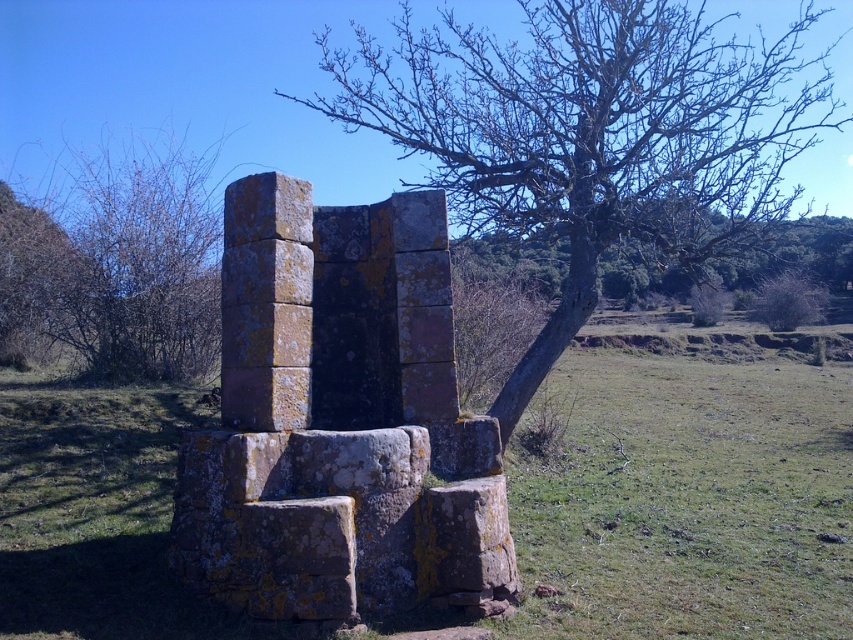
Can you confirm if smooth bark tree at center is positioned below bare branches at upper center?

Actually, smooth bark tree at center is above bare branches at upper center.

Is point (605, 28) positioned behind point (566, 268)?

No, (605, 28) is closer to viewer.

Locate an element on the screen. Image resolution: width=853 pixels, height=640 pixels. smooth bark tree at center is located at coordinates (592, 134).

Is brown mossy stone at left in front of bare branches at upper center?

No.

Does point (134, 337) come behind point (799, 220)?

No, (134, 337) is closer to viewer.

This screenshot has height=640, width=853. I want to click on brown mossy stone at left, so click(115, 268).

Is smooth bark tree at center shorter than brown mossy stone at left?

No, smooth bark tree at center is not shorter than brown mossy stone at left.

Who is more distant from viewer, [657,164] or [44,273]?

Point [657,164]

Locate an element on the screen. The height and width of the screenshot is (640, 853). smooth bark tree at center is located at coordinates (592, 134).